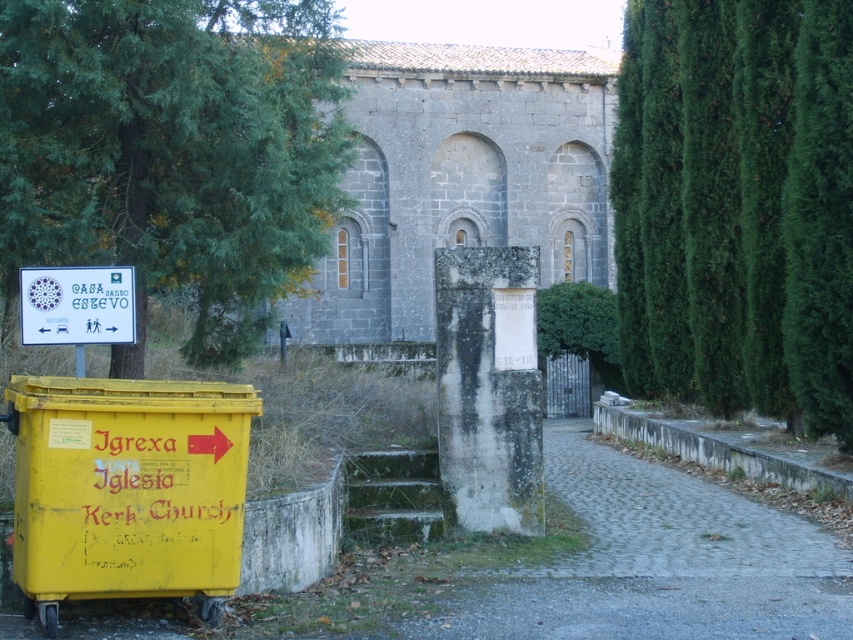
Question: Which point is closer to the camera taking this photo?

Choices:
 (A) (740, 58)
 (B) (151, 205)
 (C) (428, 324)

Answer: (B)

Question: Can you confirm if green leafy tree at upper left is positioned above gray stone church at center?

Choices:
 (A) yes
 (B) no

Answer: (B)

Question: Considering the real-world distances, which object is farthest from the gray stone church at center?

Choices:
 (A) white stone pillar at center
 (B) green leafy tree at upper left
 (C) green leafy tree at right
 (D) white paper sign at upper left

Answer: (B)

Question: Which point is farther to the camera?

Choices:
 (A) white stone pillar at center
 (B) green leafy tree at upper left

Answer: (A)

Question: From the image, what is the correct spatial relationship of green leafy tree at upper left in relation to green leafy tree at right?

Choices:
 (A) above
 (B) below

Answer: (B)

Question: Is green leafy tree at right to the right of white stone pillar at center from the viewer's perspective?

Choices:
 (A) no
 (B) yes

Answer: (B)